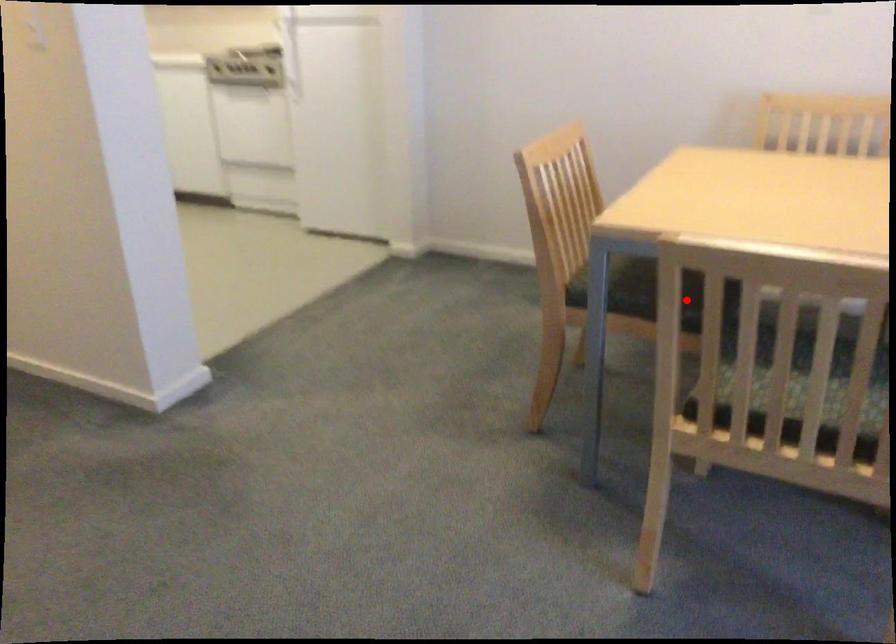
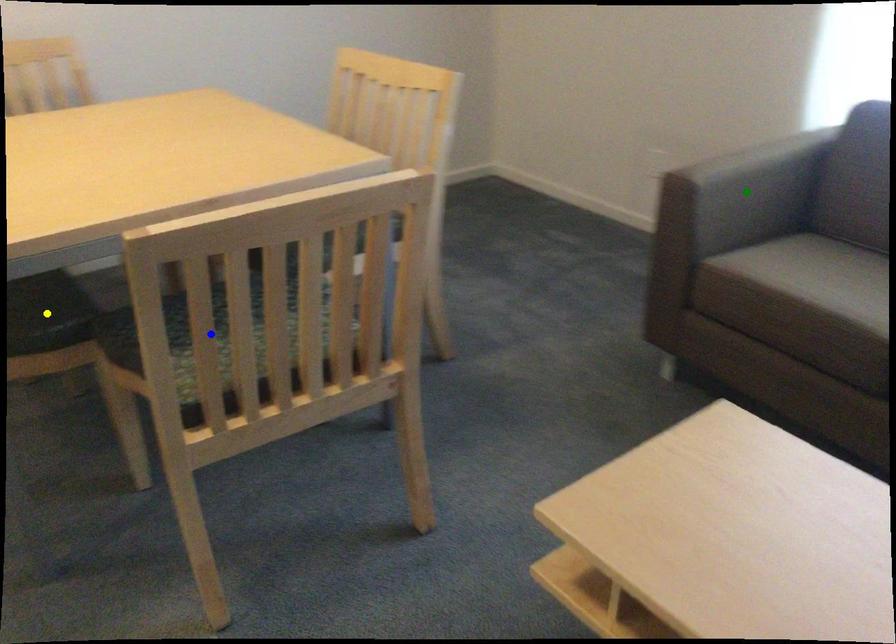
Question: I am providing you with two images of the same scene from different viewpoints. A red point is marked on the first image. You are given multiple points on the second image. In image 2, which mark is for the same physical point as the one in image 1?

Choices:
 (A) green point
 (B) yellow point
 (C) blue point

Answer: (B)